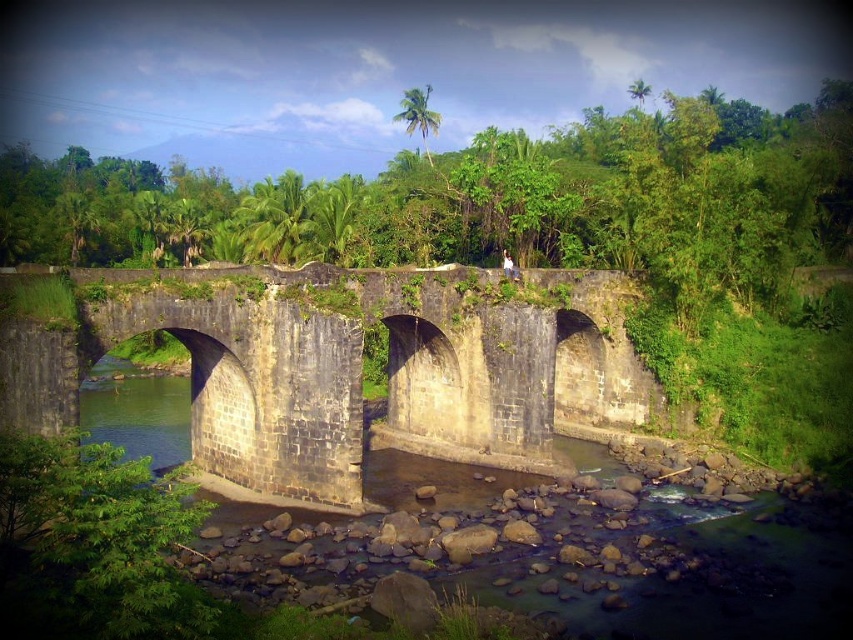
Does green leafy vegetation at center have a larger size compared to stone bridge at center?

Indeed, green leafy vegetation at center has a larger size compared to stone bridge at center.

From the picture: Does green leafy vegetation at center have a smaller size compared to stone bridge at center?

No.

Which is behind, point (419, 253) or point (242, 413)?

Positioned behind is point (419, 253).

Where is `green leafy vegetation at center`? green leafy vegetation at center is located at coordinates (546, 237).